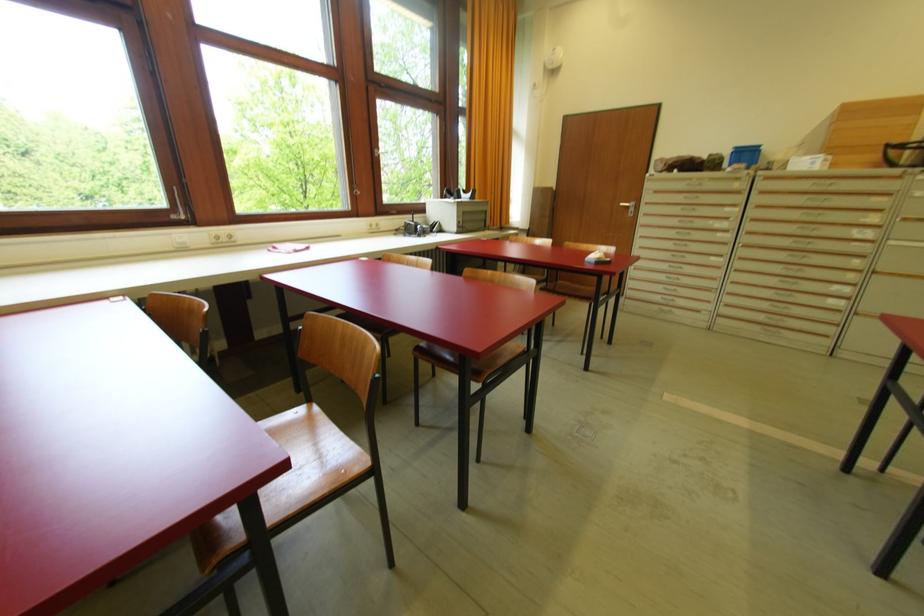
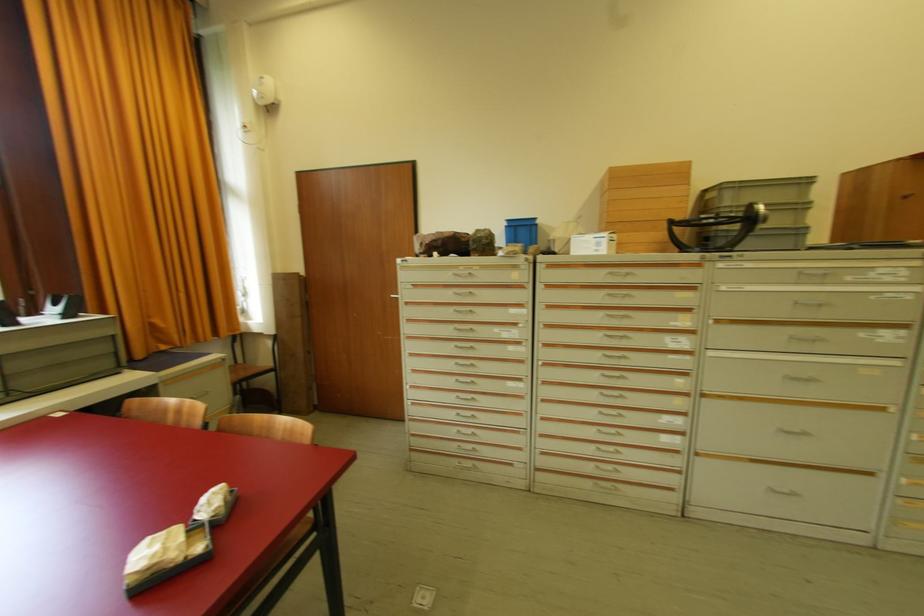
Locate, in the second image, the point that corresponds to (817,183) in the first image.

(610, 273)